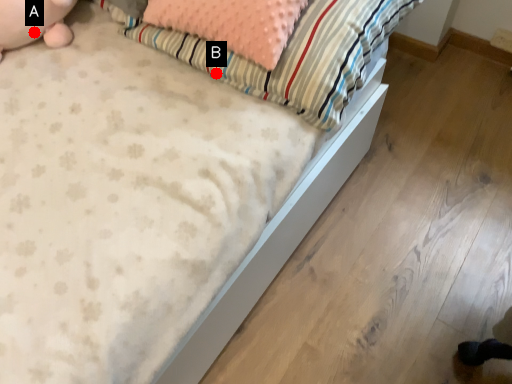
Question: Two points are circled on the image, labeled by A and B beside each circle. Which point is closer to the camera taking this photo?

Choices:
 (A) A is closer
 (B) B is closer

Answer: (B)